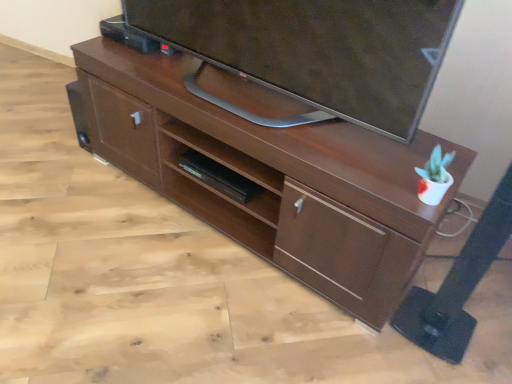
You are a GUI agent. You are given a task and a screenshot of the screen. Output one action in this format:
    pyautogui.click(x=<x>, y=<y>)
    Task: Click on the brown wood desk at center
    The height and width of the screenshot is (384, 512).
    Given the screenshot: What is the action you would take?
    pyautogui.click(x=273, y=178)

The height and width of the screenshot is (384, 512). What are the coordinates of `black matte shelf at center` in the screenshot? It's located at (234, 161).

Between black matte shelf at center and brown wood desk at center, which one has less height?

Standing shorter between the two is black matte shelf at center.

Could you tell me if black matte shelf at center is turned towards brown wood desk at center?

Yes, black matte shelf at center faces towards brown wood desk at center.

The width and height of the screenshot is (512, 384). What are the coordinates of `shelf that appears below the brown wood desk at center (from a real-world perspective)` in the screenshot? It's located at [x=234, y=161].

Who is bigger, black matte shelf at center or brown wood desk at center?

With larger size is brown wood desk at center.

Considering the relative positions of black matte shelf at center and matte black tv at upper center in the image provided, is black matte shelf at center to the left of matte black tv at upper center from the viewer's perspective?

Indeed, black matte shelf at center is positioned on the left side of matte black tv at upper center.

Is black matte shelf at center not inside matte black tv at upper center?

Yes, black matte shelf at center is located beyond the bounds of matte black tv at upper center.

Is black matte shelf at center facing away from matte black tv at upper center?

That's not correct — black matte shelf at center is not looking away from matte black tv at upper center.

Locate an element on the screen. television that is in front of the black matte shelf at center is located at coordinates (317, 50).

From the picture: Which is more distant, (234, 214) or (200, 139)?

Positioned behind is point (234, 214).

Is brown wood desk at center thinner than black matte shelf at center?

→ In fact, brown wood desk at center might be wider than black matte shelf at center.

Which object is positioned more to the right, brown wood desk at center or black matte shelf at center?

brown wood desk at center is more to the right.

Based on the photo, would you say brown wood desk at center is a long distance from black matte shelf at center?

Actually, brown wood desk at center and black matte shelf at center are a little close together.

Does brown wood desk at center have a greater height compared to matte black tv at upper center?

Indeed, brown wood desk at center has a greater height compared to matte black tv at upper center.

Is brown wood desk at center closer to the viewer compared to matte black tv at upper center?

No, the depth of brown wood desk at center is greater than that of matte black tv at upper center.

Based on their sizes in the image, would you say brown wood desk at center is bigger or smaller than matte black tv at upper center?

Clearly, brown wood desk at center is larger in size than matte black tv at upper center.

Which point is more distant from viewer, (195, 121) or (422, 42)?

The point (195, 121) is more distant.

From the image's perspective, does matte black tv at upper center appear lower than brown wood desk at center?

Actually, matte black tv at upper center appears above brown wood desk at center in the image.

Considering the sizes of matte black tv at upper center and brown wood desk at center in the image, is matte black tv at upper center wider or thinner than brown wood desk at center?

Considering their sizes, matte black tv at upper center looks slimmer than brown wood desk at center.

From the picture: Can brown wood desk at center be found inside matte black tv at upper center?

No, brown wood desk at center is not surrounded by matte black tv at upper center.

Is there a large distance between matte black tv at upper center and black matte shelf at center?

That's not correct — matte black tv at upper center is a little close to black matte shelf at center.

Is matte black tv at upper center taller or shorter than black matte shelf at center?

Clearly, matte black tv at upper center is taller compared to black matte shelf at center.

Does matte black tv at upper center have a greater width compared to black matte shelf at center?

Yes, matte black tv at upper center is wider than black matte shelf at center.

You are a GUI agent. You are given a task and a screenshot of the screen. Output one action in this format:
    pyautogui.click(x=<x>, y=<y>)
    Task: Click on the shelf on the left of matte black tv at upper center
    Image resolution: width=512 pixels, height=384 pixels.
    Given the screenshot: What is the action you would take?
    pos(234,161)

The width and height of the screenshot is (512, 384). In order to click on desk in front of the black matte shelf at center in this screenshot , I will do `click(273, 178)`.

You are a GUI agent. You are given a task and a screenshot of the screen. Output one action in this format:
    pyautogui.click(x=<x>, y=<y>)
    Task: Click on the television that appears on the right of black matte shelf at center
    The height and width of the screenshot is (384, 512).
    Given the screenshot: What is the action you would take?
    pyautogui.click(x=317, y=50)

When comparing their distances from brown wood desk at center, does black matte shelf at center or matte black tv at upper center seem further?

Based on the image, matte black tv at upper center appears to be further to brown wood desk at center.

Based on their spatial positions, is matte black tv at upper center or black matte shelf at center further from brown wood desk at center?

Among the two, matte black tv at upper center is located further to brown wood desk at center.

Based on their spatial positions, is matte black tv at upper center or brown wood desk at center closer to black matte shelf at center?

brown wood desk at center.

Consider the image. Looking at the image, which one is located further to matte black tv at upper center, brown wood desk at center or black matte shelf at center?

Among the two, black matte shelf at center is located further to matte black tv at upper center.

Estimate the real-world distances between objects in this image. Which object is further from matte black tv at upper center, black matte shelf at center or brown wood desk at center?

black matte shelf at center is further to matte black tv at upper center.

Based on their spatial positions, is brown wood desk at center or matte black tv at upper center further from black matte shelf at center?

matte black tv at upper center is further to black matte shelf at center.

This screenshot has width=512, height=384. I want to click on desk between matte black tv at upper center and black matte shelf at center in the front-back direction, so click(x=273, y=178).